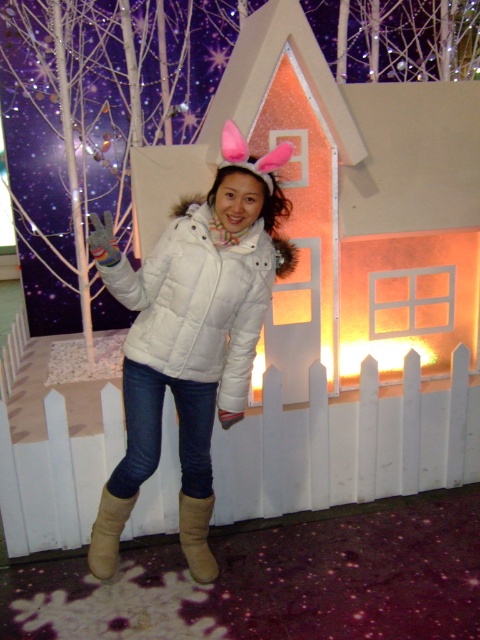
You are a photographer trying to capture the perfect shot of the person in the winter scene. You want to ensure the white matte jacket at center is centered exactly at point (191, 324). Is the jacket currently positioned correctly?

The white matte jacket at center is located at point (191, 324), so yes, it is already centered correctly at that coordinate.

You are a fashion designer trying to create a winter outfit. You have a white matte jacket at center and a brown suede boot at lower center in your collection. Which item would be more suitable for a larger frame to ensure a flattering fit?

The white matte jacket at center has a larger size compared to the brown suede boot at lower center, making it more suitable for a larger frame as it provides a better fit.